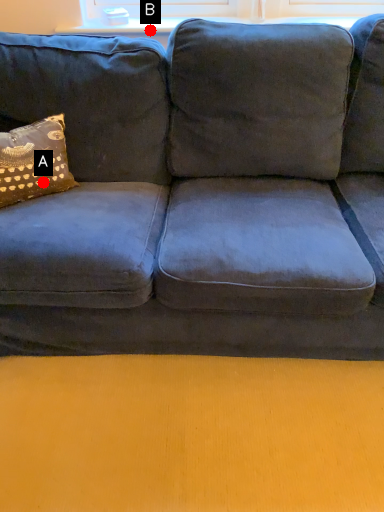
Question: Two points are circled on the image, labeled by A and B beside each circle. Which of the following is the farthest from the observer?

Choices:
 (A) A is further
 (B) B is further

Answer: (B)